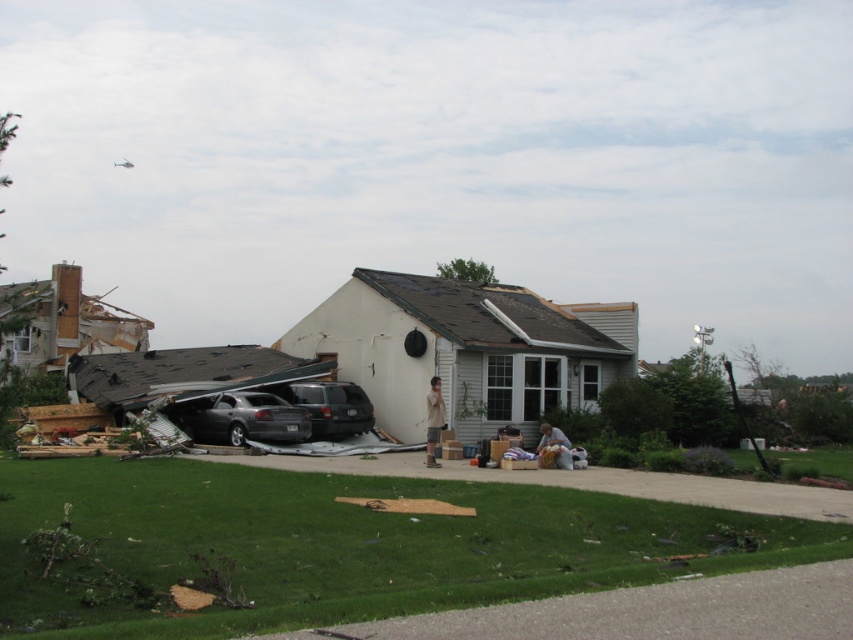
Question: Which object is farther from the camera taking this photo?

Choices:
 (A) dark gray metallic car at center
 (B) satin silver suv at center
 (C) brown cotton shirt at center

Answer: (B)

Question: Can you confirm if dark gray metallic car at center is thinner than brown cotton shirt at center?

Choices:
 (A) no
 (B) yes

Answer: (A)

Question: Is dark gray metallic car at center positioned in front of brown cotton shirt at center?

Choices:
 (A) yes
 (B) no

Answer: (B)

Question: Which point is closer to the camera?

Choices:
 (A) dark gray metallic car at center
 (B) satin silver suv at center

Answer: (A)

Question: Among these points, which one is nearest to the camera?

Choices:
 (A) (432, 456)
 (B) (370, 412)
 (C) (231, 396)

Answer: (A)

Question: Can you confirm if dark gray metallic car at center is wider than brown cotton shirt at center?

Choices:
 (A) no
 (B) yes

Answer: (B)